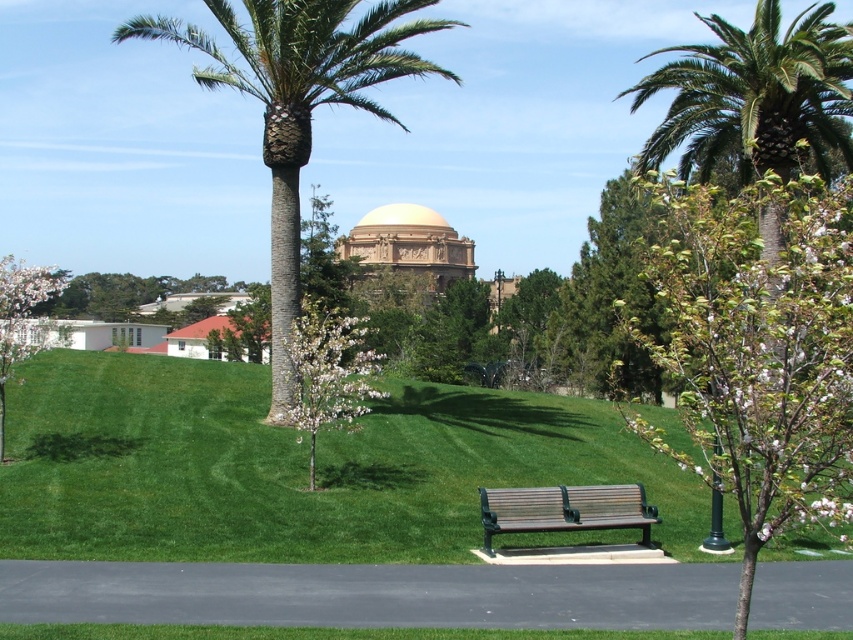
Question: Is green grass at center above green leafy palm tree at upper right?

Choices:
 (A) yes
 (B) no

Answer: (B)

Question: Is green grass at center in front of green leafy tree at center?

Choices:
 (A) yes
 (B) no

Answer: (B)

Question: Is wooden bench at center to the left of white blossoming tree at lower left from the viewer's perspective?

Choices:
 (A) no
 (B) yes

Answer: (A)

Question: Among these points, which one is nearest to the camera?

Choices:
 (A) (563, 513)
 (B) (728, 499)
 (C) (763, 536)
 (D) (283, 410)

Answer: (C)

Question: Which of the following is the farthest from the observer?

Choices:
 (A) (746, 182)
 (B) (265, 77)

Answer: (A)

Question: Which point is farther from the camera taking this photo?

Choices:
 (A) (366, 474)
 (B) (735, 243)
 (C) (840, 26)
 (D) (265, 164)

Answer: (D)